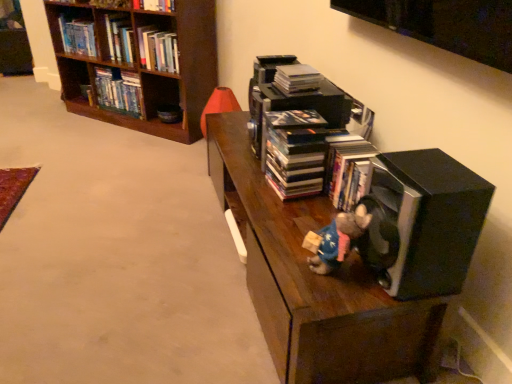
Locate an element on the screen. The width and height of the screenshot is (512, 384). unoccupied area in front of plush toy at center is located at coordinates (338, 296).